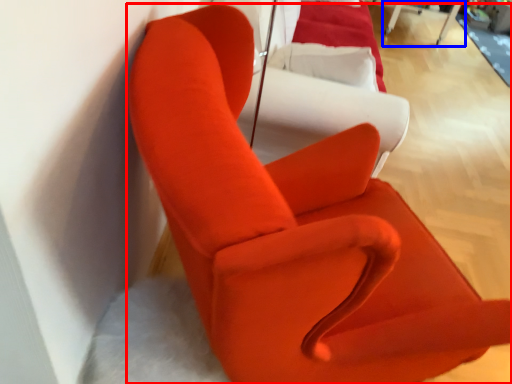
Question: Which point is closer to the camera, chair (highlighted by a red box) or table (highlighted by a blue box)?

Choices:
 (A) chair
 (B) table

Answer: (A)